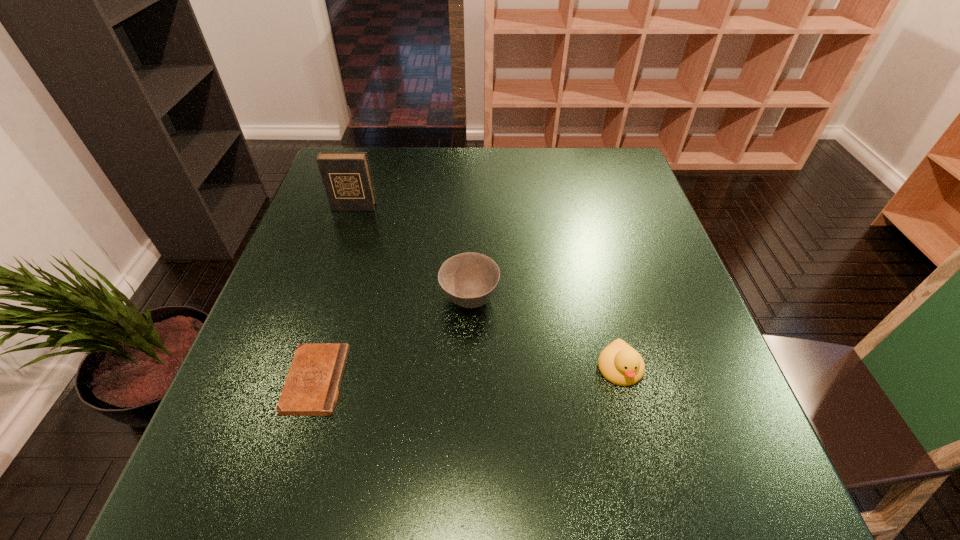
At what (x,y) coordinates should I click in order to perform the action: click on free spot located on the spine side of the shorter diary. Please return your answer as a coordinate pair (x, y). Looking at the image, I should click on (534, 380).

You are a GUI agent. You are given a task and a screenshot of the screen. Output one action in this format:
    pyautogui.click(x=<x>, y=<y>)
    Task: Click on the object at the right edge
    
    Given the screenshot: What is the action you would take?
    (x=619, y=363)

Where is `free spot at the far edge of the desktop`? free spot at the far edge of the desktop is located at coordinates (420, 149).

At what (x,y) coordinates should I click in order to perform the action: click on free space at the left edge of the desktop. Please return your answer as a coordinate pair (x, y). Image resolution: width=960 pixels, height=540 pixels. Looking at the image, I should click on (298, 260).

I want to click on vacant region at the right edge, so click(x=626, y=278).

In the image, there is a desktop. Identify the location of free region at the far right corner. click(589, 163).

Locate an element on the screen. The width and height of the screenshot is (960, 540). empty location between the tallest object and the nearer diary is located at coordinates (335, 294).

This screenshot has height=540, width=960. Find the location of `vacant area that lies between the taller diary and the bowl`. vacant area that lies between the taller diary and the bowl is located at coordinates (412, 253).

Image resolution: width=960 pixels, height=540 pixels. I want to click on vacant area that lies between the duckling and the second farthest object, so click(544, 334).

Identify the location of free spot between the duckling and the third nearest object. The image size is (960, 540). tap(544, 334).